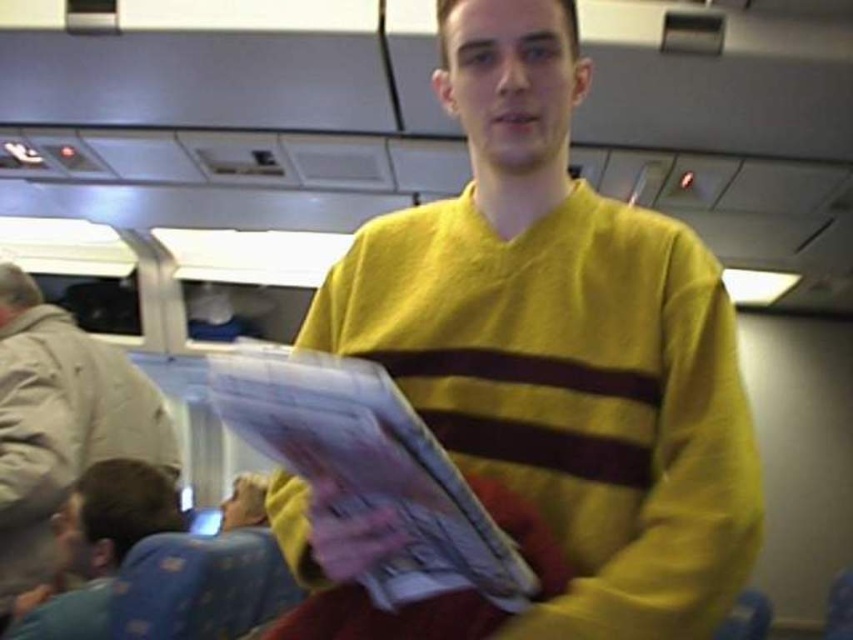
Is yellow cotton sweater at center to the right of light brown leather jacket at left from the viewer's perspective?

Indeed, yellow cotton sweater at center is positioned on the right side of light brown leather jacket at left.

Can you confirm if yellow cotton sweater at center is positioned to the left of light brown leather jacket at left?

In fact, yellow cotton sweater at center is to the right of light brown leather jacket at left.

Is point (529, 248) positioned after point (13, 451)?

No.

Where is `yellow cotton sweater at center`? yellow cotton sweater at center is located at coordinates (561, 344).

Who is lower down, light brown leather jacket at left or blue dotted pajama pants at lower left?

blue dotted pajama pants at lower left is below.

Between point (53, 444) and point (30, 612), which one is positioned in front?

Positioned in front is point (30, 612).

Describe the element at coordinates (61, 424) in the screenshot. This screenshot has width=853, height=640. I see `light brown leather jacket at left` at that location.

I want to click on light brown leather jacket at left, so click(x=61, y=424).

Does yellow cotton sweater at center come behind blue dotted pajama pants at lower left?

That is False.

Does yellow cotton sweater at center appear under blue dotted pajama pants at lower left?

Actually, yellow cotton sweater at center is above blue dotted pajama pants at lower left.

This screenshot has width=853, height=640. What do you see at coordinates (561, 344) in the screenshot?
I see `yellow cotton sweater at center` at bounding box center [561, 344].

Find the location of a particular element. The height and width of the screenshot is (640, 853). yellow cotton sweater at center is located at coordinates (561, 344).